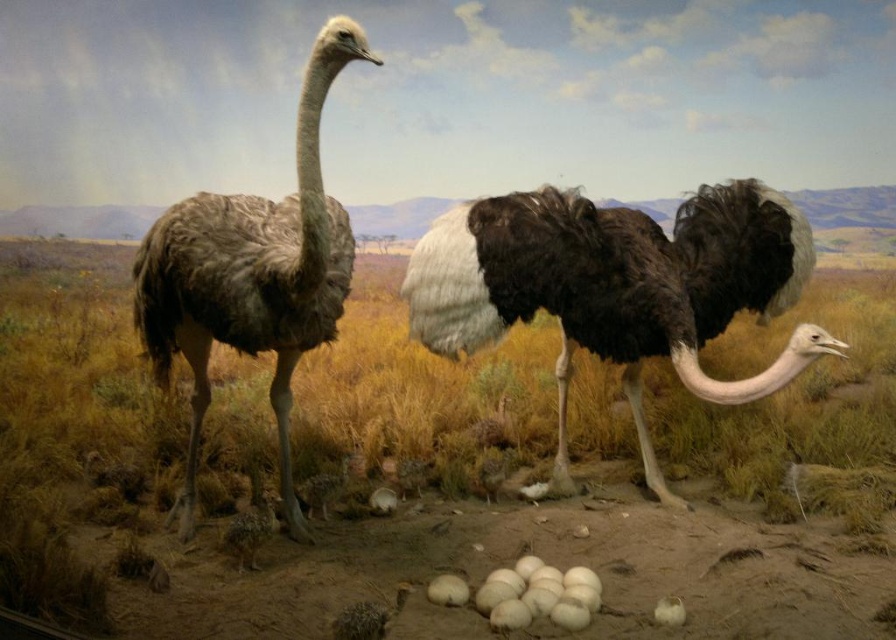
Question: Can you confirm if dark brown feathers at center is positioned above brown feathered ostrich at left?

Choices:
 (A) no
 (B) yes

Answer: (A)

Question: Which of the following is the closest to the observer?

Choices:
 (A) dark brown feathers at center
 (B) brown grass at center

Answer: (A)

Question: Which of these objects is positioned closest to the brown grass at center?

Choices:
 (A) brown feathered ostrich at left
 (B) dark brown feathers at center

Answer: (A)

Question: Is brown grass at center thinner than dark brown feathers at center?

Choices:
 (A) yes
 (B) no

Answer: (A)

Question: Among these points, which one is nearest to the camera?

Choices:
 (A) (221, 323)
 (B) (815, 332)

Answer: (B)

Question: Does brown grass at center appear under dark brown feathers at center?

Choices:
 (A) no
 (B) yes

Answer: (B)